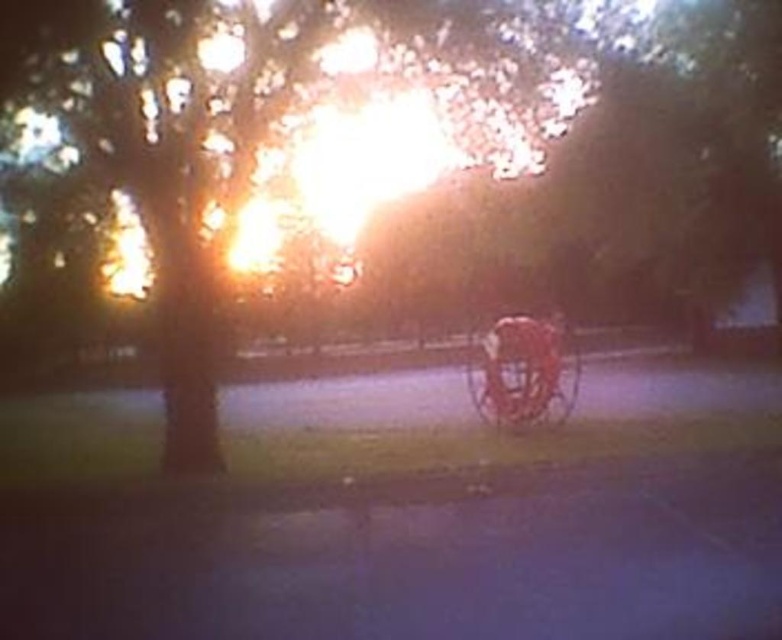
You are standing on the paved surface where the red chair is located. You want to walk towards the metallic gold horse cart at center. Which direction should you move relative to the green matte tree at center?

To reach the metallic gold horse cart at center from the red chair, you should move to the right of the green matte tree at center since the green matte tree at center is positioned to the left of the metallic gold horse cart at center.

In the scene shown: You are a photographer setting up a shot of the green matte tree at center and the metallic gold horse cart at center. You want to ensure both are in focus. Which object should you adjust your focus on first to account for their sizes?

The green matte tree at center is wider than the metallic gold horse cart at center, so you should focus on the larger object first to ensure it is sharp.

You are standing in the middle of a garden and see both the green matte tree at center and the metallic gold horse cart at center. Which object is nearer to you?

The green matte tree at center is closer to the viewer than the metallic gold horse cart at center.